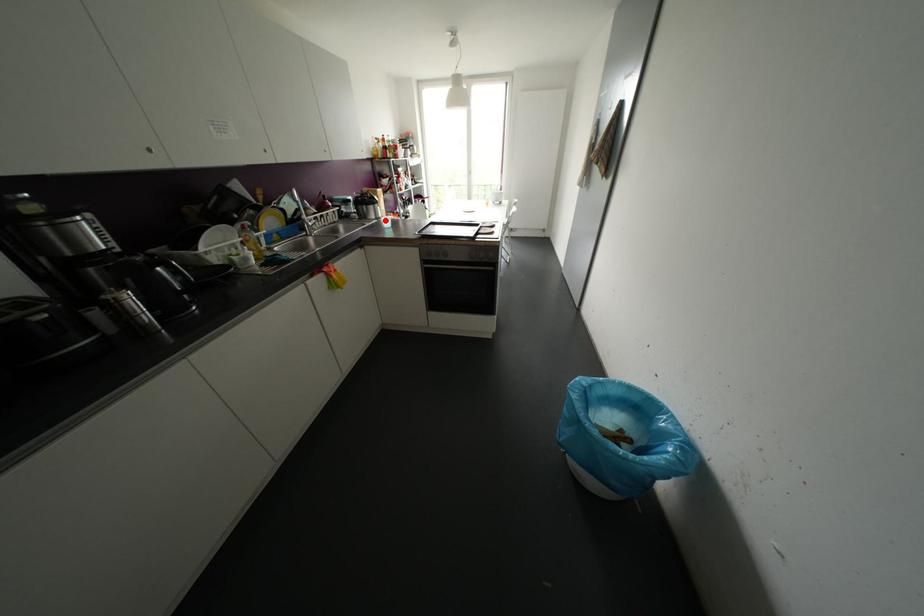
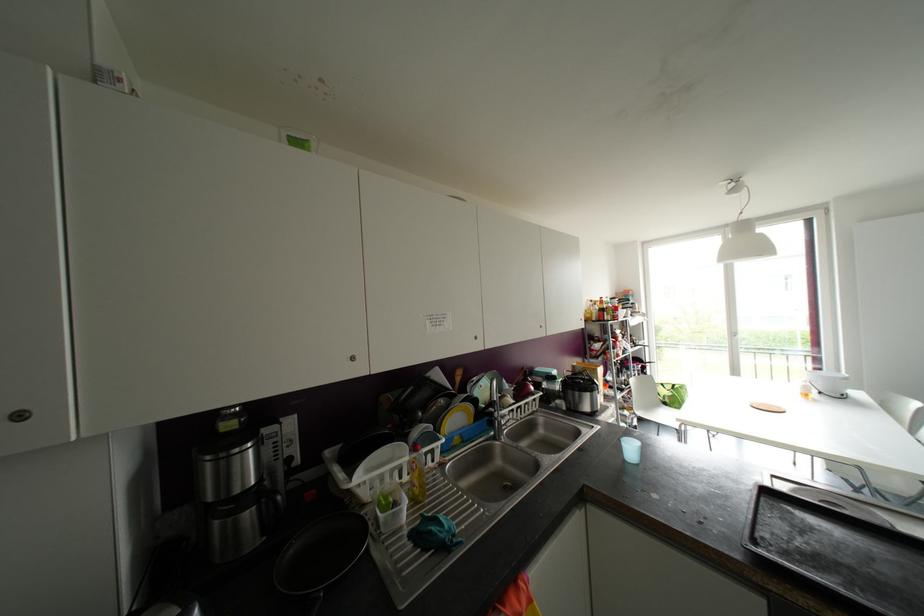
Where in the second image is the point corresponding to the highlighted location from the first image?

(629, 448)